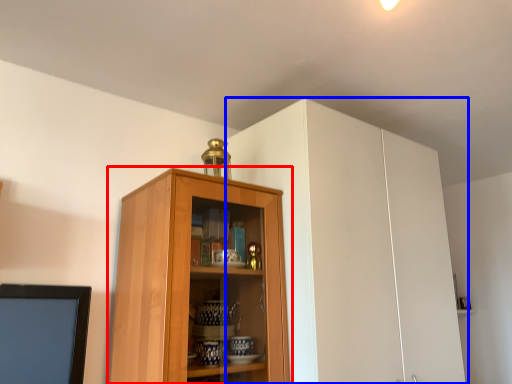
Question: Which point is closer to the camera, cupboard (highlighted by a red box) or cabinetry (highlighted by a blue box)?

Choices:
 (A) cupboard
 (B) cabinetry

Answer: (A)